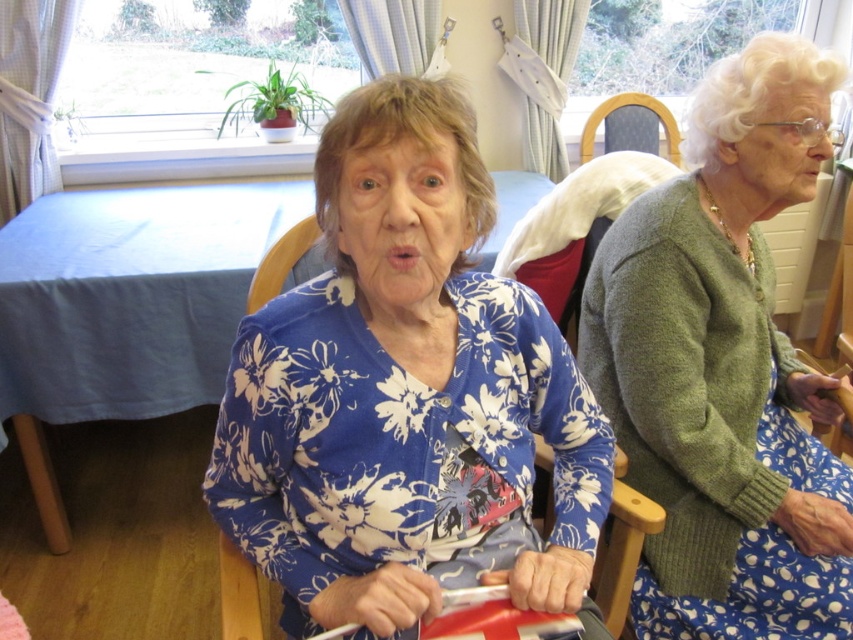
Question: Which object appears closest to the camera in this image?

Choices:
 (A) blue floral cardigan at center
 (B) dark brown leather chair at upper center
 (C) green woolen cardigan at right

Answer: (A)

Question: Can you confirm if blue floral cardigan at center is positioned to the right of green woolen cardigan at right?

Choices:
 (A) yes
 (B) no

Answer: (B)

Question: Which point is farther from the camera taking this photo?

Choices:
 (A) (610, 129)
 (B) (366, 164)

Answer: (A)

Question: Is blue floral cardigan at center smaller than green woolen cardigan at right?

Choices:
 (A) no
 (B) yes

Answer: (B)

Question: Does green woolen cardigan at right have a smaller size compared to dark brown leather chair at upper center?

Choices:
 (A) no
 (B) yes

Answer: (A)

Question: Which of the following is the closest to the observer?

Choices:
 (A) dark brown leather chair at upper center
 (B) blue floral cardigan at center
 (C) green woolen cardigan at right

Answer: (B)